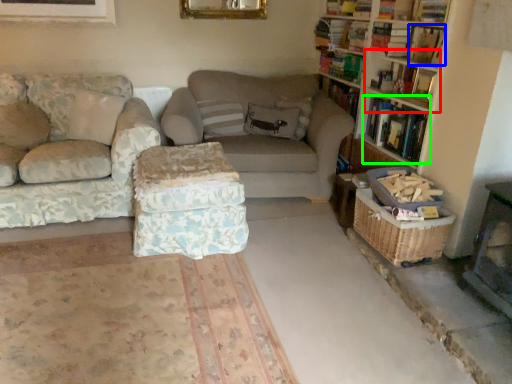
Question: Considering the real-world distances, which object is farthest from shelf (highlighted by a red box)? book (highlighted by a blue box) or book (highlighted by a green box)?

Choices:
 (A) book
 (B) book

Answer: (A)